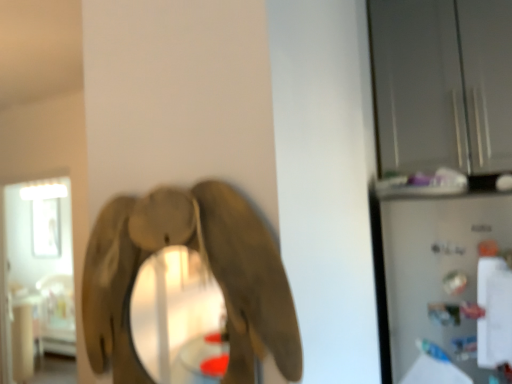
Question: Is transparent glass cabinet at upper right, the first glass door when ordered from top to bottom, surrounding satin silver refrigerator at right?

Choices:
 (A) yes
 (B) no

Answer: (B)

Question: Considering the relative sizes of transparent glass cabinet at upper right, the first glass door when ordered from top to bottom, and satin silver refrigerator at right in the image provided, is transparent glass cabinet at upper right, the first glass door when ordered from top to bottom, thinner than satin silver refrigerator at right?

Choices:
 (A) no
 (B) yes

Answer: (A)

Question: Is transparent glass cabinet at upper right, the first glass door when ordered from top to bottom, oriented away from satin silver refrigerator at right?

Choices:
 (A) yes
 (B) no

Answer: (B)

Question: Is transparent glass cabinet at upper right, which is the 1th glass door from right to left, oriented towards satin silver refrigerator at right?

Choices:
 (A) no
 (B) yes

Answer: (A)

Question: From the image's perspective, is transparent glass cabinet at upper right, which is the 1th glass door from right to left, on top of satin silver refrigerator at right?

Choices:
 (A) no
 (B) yes

Answer: (B)

Question: Is transparent glass cabinet at upper right, the second glass door in the left-to-right sequence, beside satin silver refrigerator at right?

Choices:
 (A) yes
 (B) no

Answer: (B)

Question: Does wooden elephant at center have a lesser height compared to transparent glass door at left, arranged as the 2th glass door when viewed from the right?

Choices:
 (A) no
 (B) yes

Answer: (B)

Question: From the image's perspective, does wooden elephant at center appear higher than transparent glass door at left, arranged as the 2th glass door when viewed from the right?

Choices:
 (A) yes
 (B) no

Answer: (A)

Question: From the image's perspective, would you say wooden elephant at center is shown under transparent glass door at left, arranged as the 2th glass door when viewed from the right?

Choices:
 (A) no
 (B) yes

Answer: (A)

Question: Does wooden elephant at center have a smaller size compared to transparent glass door at left, marked as the second glass door in a top-to-bottom arrangement?

Choices:
 (A) yes
 (B) no

Answer: (A)

Question: Would you say wooden elephant at center is outside transparent glass door at left, which is counted as the 1th glass door, starting from the left?

Choices:
 (A) no
 (B) yes

Answer: (B)

Question: Can you see wooden elephant at center touching transparent glass door at left, arranged as the 2th glass door when viewed from the right?

Choices:
 (A) no
 (B) yes

Answer: (A)

Question: Can you confirm if transparent glass cabinet at upper right, acting as the second glass door starting from the back, is positioned to the left of wooden elephant at center?

Choices:
 (A) no
 (B) yes

Answer: (A)